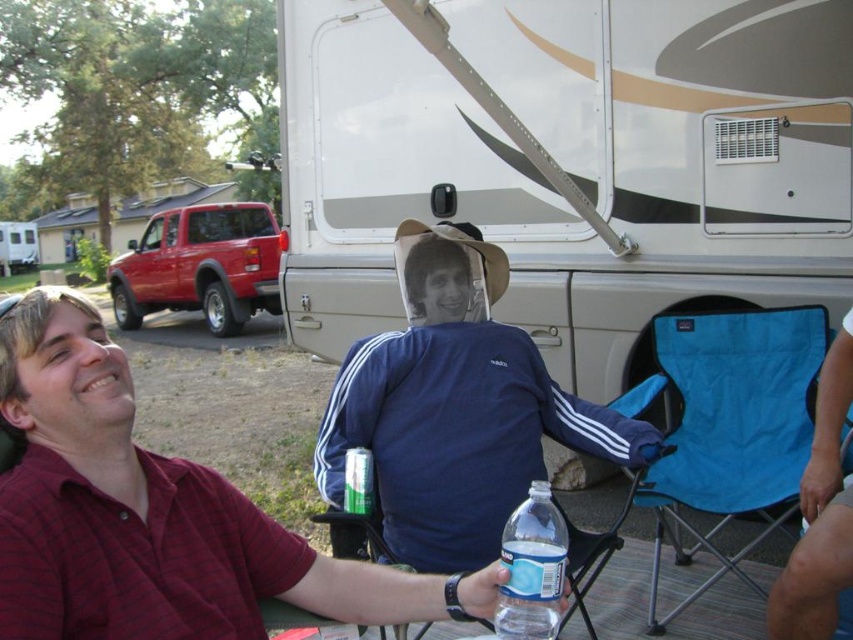
Question: Is maroon cotton shirt at lower left wider than white glossy recreational vehicle at upper center?

Choices:
 (A) yes
 (B) no

Answer: (B)

Question: Based on their relative distances, which object is farther from the white glossy recreational vehicle at upper center?

Choices:
 (A) clear plastic bottle at lower center
 (B) blue fabric chair at lower right
 (C) metallic red truck at left
 (D) maroon cotton shirt at lower left

Answer: (D)

Question: Based on their relative distances, which object is farther from the clear plastic bottle at lower center?

Choices:
 (A) blue fabric chair at center
 (B) maroon cotton shirt at lower left
 (C) white glossy recreational vehicle at upper center
 (D) metallic red truck at left

Answer: (C)

Question: Is blue fabric chair at lower right to the right of clear plastic bottle at lower center from the viewer's perspective?

Choices:
 (A) no
 (B) yes

Answer: (B)

Question: Which point is farther to the camera?

Choices:
 (A) (239, 330)
 (B) (514, 577)

Answer: (A)

Question: Is maroon cotton shirt at lower left further to the viewer compared to clear plastic bottle at lower center?

Choices:
 (A) no
 (B) yes

Answer: (A)